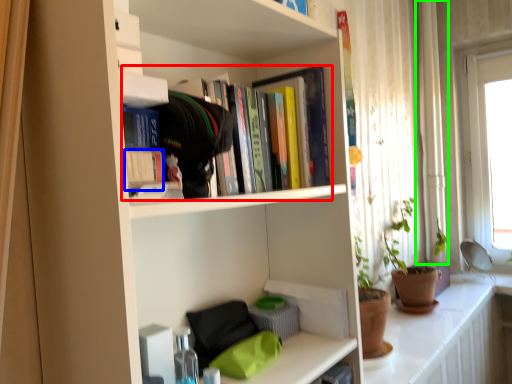
Question: Estimate the real-world distances between objects in this image. Which object is farther from book (highlighted by a red box), paperback book (highlighted by a blue box) or curtain (highlighted by a green box)?

Choices:
 (A) paperback book
 (B) curtain

Answer: (B)